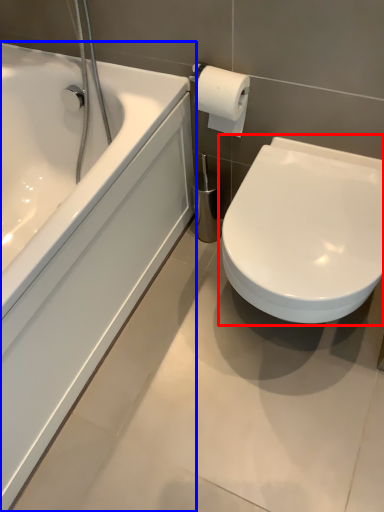
Question: Which point is closer to the camera, toilet (highlighted by a red box) or bathtub (highlighted by a blue box)?

Choices:
 (A) toilet
 (B) bathtub

Answer: (B)